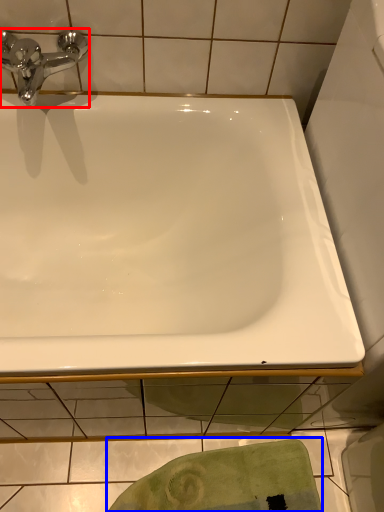
Question: Which object appears farthest to the camera in this image, tap (highlighted by a red box) or bath towel (highlighted by a blue box)?

Choices:
 (A) tap
 (B) bath towel

Answer: (B)